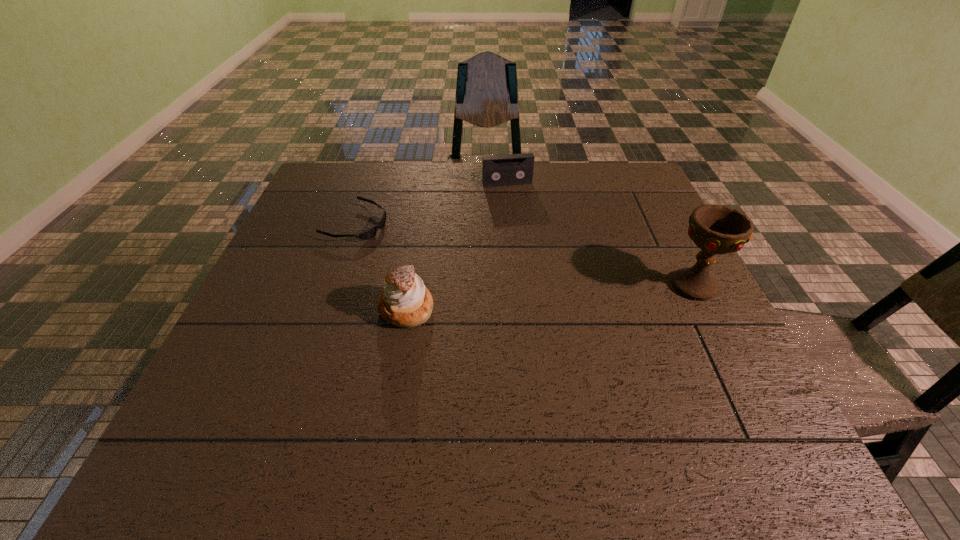
Find the location of a particular element. This screenshot has height=540, width=960. free space located 0.310m on the front-facing side of the videotape is located at coordinates (533, 251).

I want to click on vacant region located on the front-facing side of the videotape, so click(537, 261).

Where is `vacant position located 0.080m on the front-facing side of the videotape`? The width and height of the screenshot is (960, 540). vacant position located 0.080m on the front-facing side of the videotape is located at coordinates pos(516,202).

The image size is (960, 540). I want to click on blank area located on the front-facing side of the leftmost object, so click(x=436, y=248).

You are a GUI agent. You are given a task and a screenshot of the screen. Output one action in this format:
    pyautogui.click(x=<x>, y=<y>)
    Task: Click on the vacant space located 0.360m on the front-facing side of the leftmost object
    This screenshot has height=540, width=960.
    Given the screenshot: What is the action you would take?
    pyautogui.click(x=504, y=269)

Locate an element on the screen. The image size is (960, 540). blank area located on the front-facing side of the leftmost object is located at coordinates (406, 239).

Locate an element on the screen. This screenshot has height=540, width=960. object located in the far edge section of the desktop is located at coordinates (497, 170).

Find the location of a particular element. Image resolution: width=960 pixels, height=540 pixels. object positioned at the left edge is located at coordinates (371, 232).

The width and height of the screenshot is (960, 540). In order to click on object that is at the right edge in this screenshot , I will do `click(716, 229)`.

You are a GUI agent. You are given a task and a screenshot of the screen. Output one action in this format:
    pyautogui.click(x=<x>, y=<y>)
    Task: Click on the free space at the far edge
    
    Given the screenshot: What is the action you would take?
    pyautogui.click(x=587, y=162)